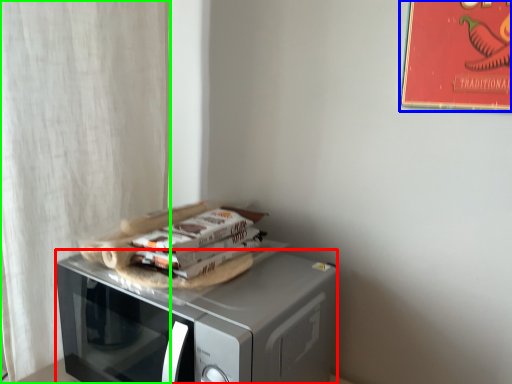
Question: Which object is positioned closest to microwave oven (highlighted by a red box)? Select from bulletin board (highlighted by a blue box) and curtain (highlighted by a green box).

Choices:
 (A) bulletin board
 (B) curtain

Answer: (B)